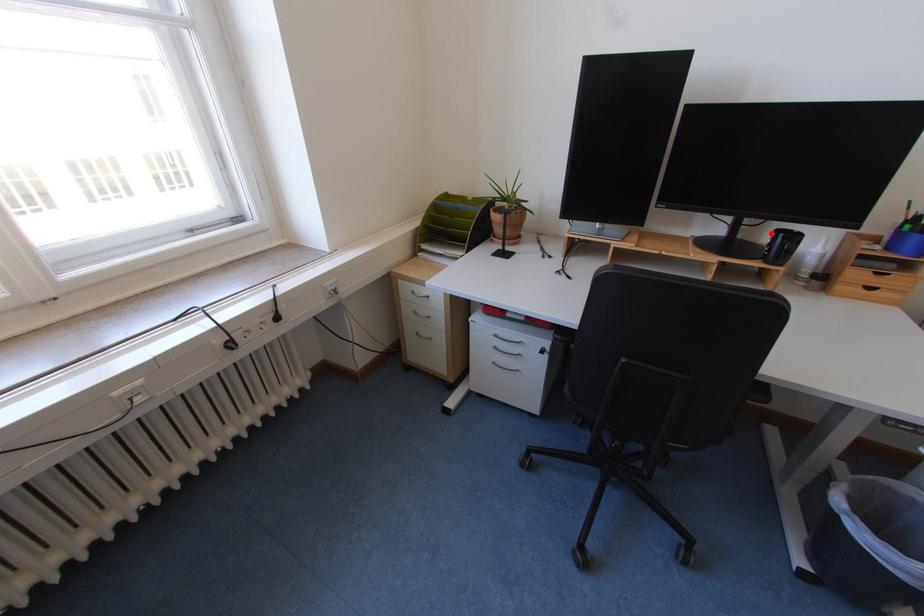
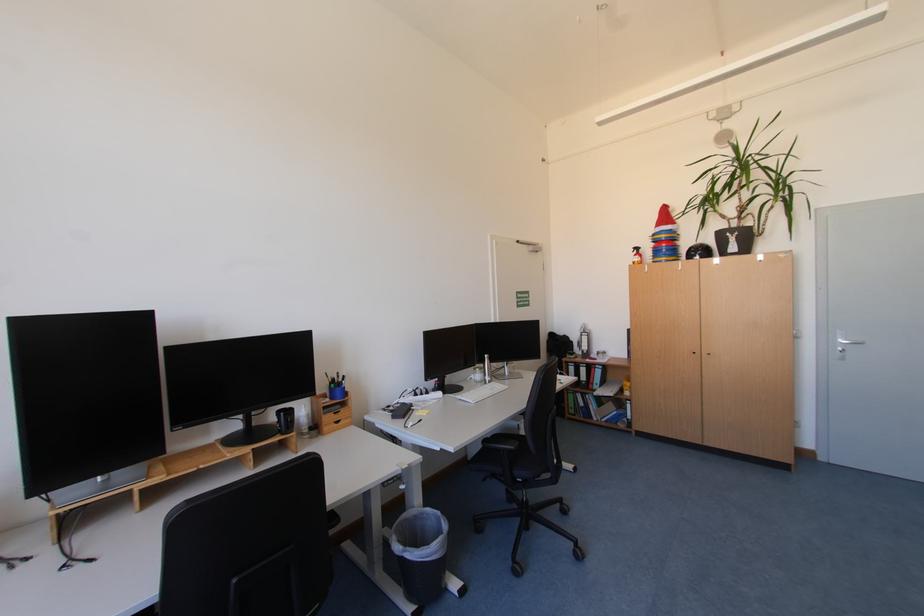
In the second image, find the point that corresponds to the highlighted location in the first image.

(277, 416)